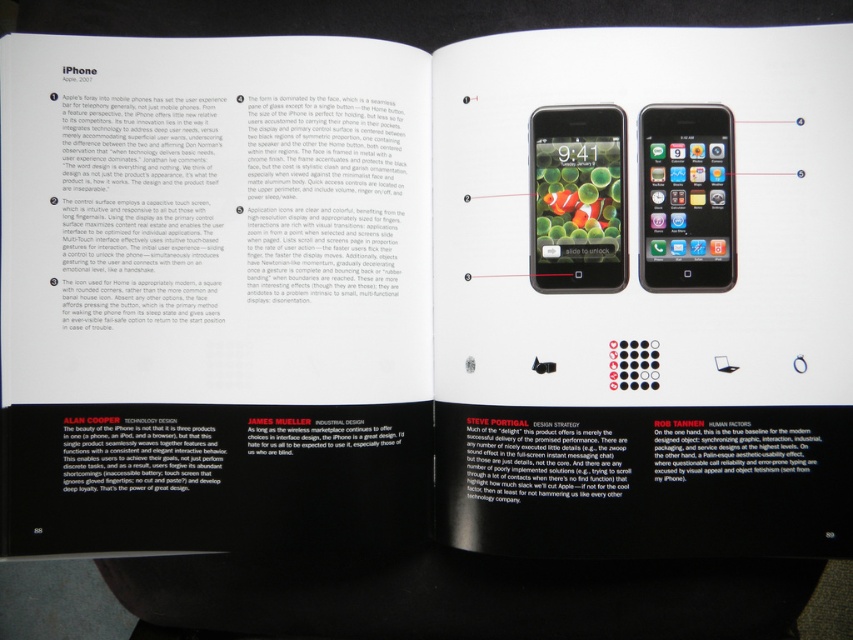
Question: Does matte black iphone at center appear under matte black iphone at upper center?

Choices:
 (A) yes
 (B) no

Answer: (A)

Question: Among these objects, which one is farthest from the camera?

Choices:
 (A) matte black iphone at upper center
 (B) matte black iphone at center

Answer: (B)

Question: Can you confirm if matte black iphone at center is thinner than matte black iphone at upper center?

Choices:
 (A) yes
 (B) no

Answer: (B)

Question: Is matte black iphone at center further to camera compared to matte black iphone at upper center?

Choices:
 (A) no
 (B) yes

Answer: (B)

Question: Which object is farther from the camera taking this photo?

Choices:
 (A) matte black iphone at center
 (B) matte black iphone at upper center

Answer: (A)

Question: Which object appears farthest from the camera in this image?

Choices:
 (A) matte black iphone at center
 (B) matte black iphone at upper center

Answer: (A)